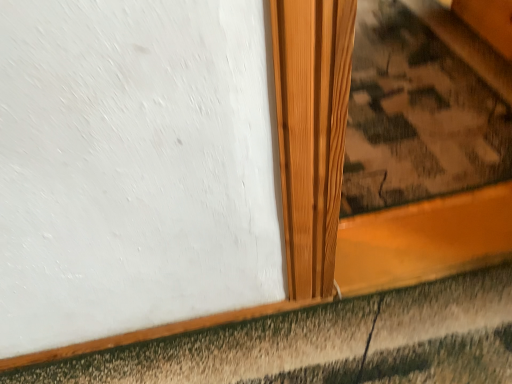
Describe the element at coordinates (422, 108) in the screenshot. I see `natural wood stair at center` at that location.

From the picture: Measure the distance between natural wood stair at center and camera.

1.31 meters.

Locate an element on the screen. The width and height of the screenshot is (512, 384). natural wood stair at center is located at coordinates (422, 108).

You are a GUI agent. You are given a task and a screenshot of the screen. Output one action in this format:
    pyautogui.click(x=<x>, y=<y>)
    Task: Click on the natural wood stair at center
    This screenshot has width=512, height=384.
    Given the screenshot: What is the action you would take?
    pyautogui.click(x=422, y=108)